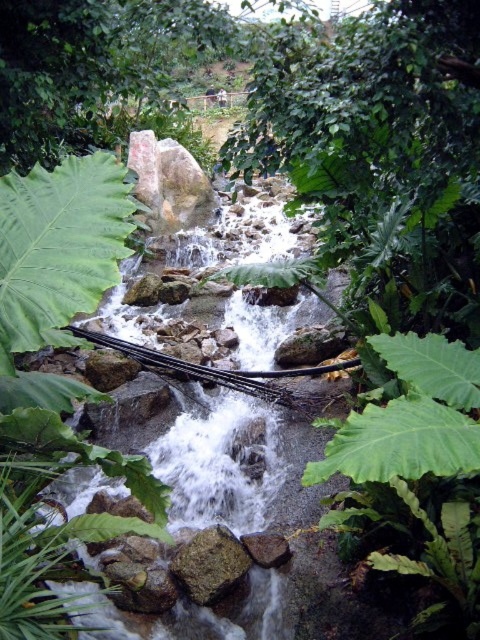
Who is positioned more to the left, green leafy fern at center or brown rough rock at center?

green leafy fern at center

This screenshot has height=640, width=480. Describe the element at coordinates (45, 554) in the screenshot. I see `green leafy fern at center` at that location.

Who is more forward, (26,566) or (214,548)?

Positioned in front is point (26,566).

In order to click on green leafy fern at center in this screenshot , I will do `click(45, 554)`.